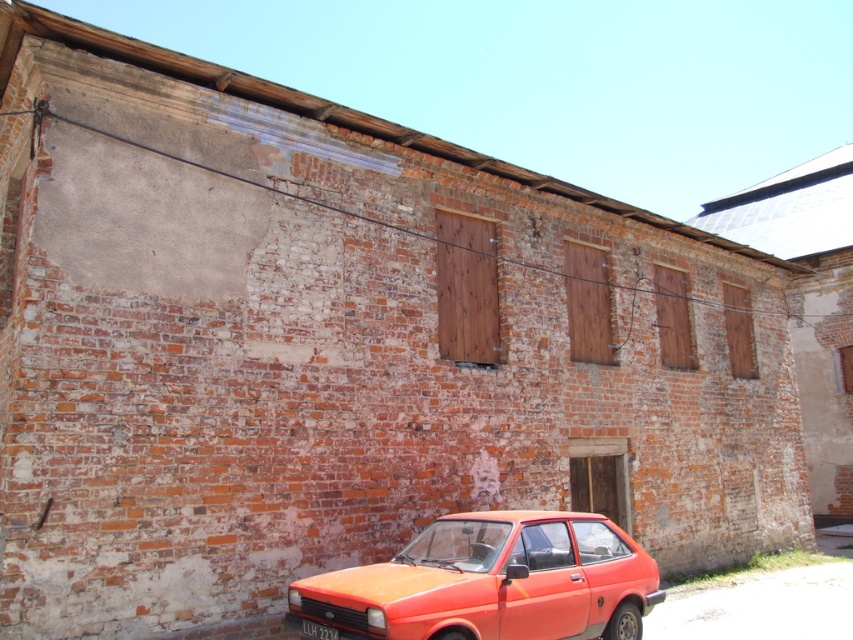
Question: Does orange matte car at lower center have a smaller size compared to yellow plastic license plate at lower center?

Choices:
 (A) no
 (B) yes

Answer: (A)

Question: Can you confirm if orange matte car at lower center is wider than yellow plastic license plate at lower center?

Choices:
 (A) no
 (B) yes

Answer: (B)

Question: Which of the following is the closest to the observer?

Choices:
 (A) yellow plastic license plate at lower center
 (B) orange matte car at lower center

Answer: (B)

Question: Does orange matte car at lower center come in front of yellow plastic license plate at lower center?

Choices:
 (A) yes
 (B) no

Answer: (A)

Question: Which object is closer to the camera taking this photo?

Choices:
 (A) orange matte car at lower center
 (B) yellow plastic license plate at lower center

Answer: (A)

Question: Among these objects, which one is nearest to the camera?

Choices:
 (A) yellow plastic license plate at lower center
 (B) orange matte car at lower center

Answer: (B)